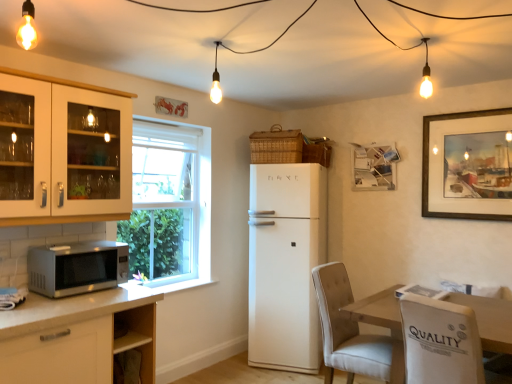
The image size is (512, 384). What do you see at coordinates (285, 264) in the screenshot?
I see `white matte refrigerator at center` at bounding box center [285, 264].

In order to face wooden framed painting at upper right, should I rotate leftwards or rightwards?

Rotate your view right by about 26.276°.

You are a GUI agent. You are given a task and a screenshot of the screen. Output one action in this format:
    pyautogui.click(x=<x>, y=<y>)
    Task: Click on the woven brown basket at upper center, placed as the second basket when sorted from left to right
    The width and height of the screenshot is (512, 384).
    Given the screenshot: What is the action you would take?
    pyautogui.click(x=317, y=153)

You are a GUI agent. You are given a task and a screenshot of the screen. Output one action in this format:
    pyautogui.click(x=<x>, y=<y>)
    Task: Click on the white matte refrigerator at center
    This screenshot has width=512, height=384.
    Given the screenshot: What is the action you would take?
    [285, 264]

From the image's perspective, does woven brown basket at upper center, the 1th basket viewed from the right, appear higher than white matte refrigerator at center?

Yes, from the image's perspective, woven brown basket at upper center, the 1th basket viewed from the right, is on top of white matte refrigerator at center.

Considering the positions of points (328, 163) and (285, 230), is point (328, 163) farther from camera compared to point (285, 230)?

Yes, point (328, 163) is farther from viewer.

In the scene shown: Who is bigger, woven brown basket at upper center, the 1th basket viewed from the right, or white matte refrigerator at center?

Bigger between the two is white matte refrigerator at center.

What's the angular difference between woven brown basket at upper center, the 1th basket viewed from the right, and white matte refrigerator at center's facing directions?

The angle between the facing direction of woven brown basket at upper center, the 1th basket viewed from the right, and the facing direction of white matte refrigerator at center is 19 degrees.

Could you measure the distance between wooden framed painting at upper right and woven brown basket at upper center, placed as the 2th basket when sorted from right to left?

A distance of 1.26 meters exists between wooden framed painting at upper right and woven brown basket at upper center, placed as the 2th basket when sorted from right to left.

From a real-world perspective, is wooden framed painting at upper right below woven brown basket at upper center, which ranks as the 1th basket in left-to-right order?

Yes, from a real-world perspective, wooden framed painting at upper right is beneath woven brown basket at upper center, which ranks as the 1th basket in left-to-right order.

Between wooden framed painting at upper right and woven brown basket at upper center, placed as the 2th basket when sorted from right to left, which one is positioned behind?

woven brown basket at upper center, placed as the 2th basket when sorted from right to left, is more distant.

Is wooden framed painting at upper right looking in the opposite direction of woven brown basket at upper center, placed as the 2th basket when sorted from right to left?

No.

Consider the image. From a real-world perspective, between woven brown basket at upper center, placed as the second basket when sorted from left to right, and satin silver microwave at lower left, who is vertically higher?

woven brown basket at upper center, placed as the second basket when sorted from left to right, is physically above.

Does woven brown basket at upper center, placed as the second basket when sorted from left to right, have a larger size compared to satin silver microwave at lower left?

No, woven brown basket at upper center, placed as the second basket when sorted from left to right, is not bigger than satin silver microwave at lower left.

Is point (326, 151) farther from viewer compared to point (114, 271)?

Yes, point (326, 151) is farther from viewer.

Does woven brown basket at upper center, the 1th basket viewed from the right, turn towards satin silver microwave at lower left?

Yes, woven brown basket at upper center, the 1th basket viewed from the right, is turned towards satin silver microwave at lower left.

From the image's perspective, who appears lower, white fabric chair at lower right or wooden framed painting at upper right?

white fabric chair at lower right, from the image's perspective.

From a real-world perspective, who is located lower, white fabric chair at lower right or wooden framed painting at upper right?

white fabric chair at lower right.

Which is more to the left, white fabric chair at lower right or wooden framed painting at upper right?

From the viewer's perspective, white fabric chair at lower right appears more on the left side.

Measure the distance from white fabric chair at lower right to white matte refrigerator at center.

white fabric chair at lower right is 25.99 inches from white matte refrigerator at center.

Considering the positions of objects white fabric chair at lower right and white matte refrigerator at center in the image provided, who is more to the right, white fabric chair at lower right or white matte refrigerator at center?

white fabric chair at lower right.

Considering the sizes of objects white fabric chair at lower right and white matte refrigerator at center in the image provided, who is wider, white fabric chair at lower right or white matte refrigerator at center?

With larger width is white matte refrigerator at center.

Is white fabric chair at lower right facing towards white matte refrigerator at center?

No, white fabric chair at lower right is not aimed at white matte refrigerator at center.

Where is `table below the woven brown basket at upper center, the 1th basket viewed from the right (from a real-world perspective)`? table below the woven brown basket at upper center, the 1th basket viewed from the right (from a real-world perspective) is located at coordinates (490, 320).

Based on the photo, between wooden table at lower right and woven brown basket at upper center, the 1th basket viewed from the right, which one is positioned in front?

wooden table at lower right is more forward.

Is wooden table at lower right situated inside woven brown basket at upper center, placed as the second basket when sorted from left to right, or outside?

→ wooden table at lower right is spatially situated outside woven brown basket at upper center, placed as the second basket when sorted from left to right.

Is wooden table at lower right aimed at woven brown basket at upper center, placed as the second basket when sorted from left to right?

No, wooden table at lower right is not turned towards woven brown basket at upper center, placed as the second basket when sorted from left to right.

Between point (277, 307) and point (283, 137), which one is positioned behind?

The point (283, 137) is farther.

Is white matte refrigerator at center beside woven brown basket at upper center, placed as the 2th basket when sorted from right to left?

They are not placed beside each other.

From the image's perspective, which one is positioned higher, white matte refrigerator at center or woven brown basket at upper center, which ranks as the 1th basket in left-to-right order?

woven brown basket at upper center, which ranks as the 1th basket in left-to-right order, is shown above in the image.

Considering the relative sizes of white matte refrigerator at center and woven brown basket at upper center, placed as the 2th basket when sorted from right to left, in the image provided, is white matte refrigerator at center shorter than woven brown basket at upper center, placed as the 2th basket when sorted from right to left,?

Incorrect, the height of white matte refrigerator at center does not fall short of that of woven brown basket at upper center, placed as the 2th basket when sorted from right to left.

This screenshot has height=384, width=512. In order to click on refrigerator lying below the woven brown basket at upper center, the 1th basket viewed from the right (from the image's perspective) in this screenshot , I will do `click(285, 264)`.

Where is `picture frame below the woven brown basket at upper center, placed as the 2th basket when sorted from right to left (from a real-world perspective)`? Image resolution: width=512 pixels, height=384 pixels. picture frame below the woven brown basket at upper center, placed as the 2th basket when sorted from right to left (from a real-world perspective) is located at coordinates (468, 165).

Based on their spatial positions, is white matte refrigerator at center or white glass cabinet at left further from satin silver microwave at lower left?

white matte refrigerator at center.

When comparing their distances from wooden table at lower right, does white matte refrigerator at center or woven brown basket at upper center, placed as the second basket when sorted from left to right, seem further?

Among the two, woven brown basket at upper center, placed as the second basket when sorted from left to right, is located further to wooden table at lower right.

Considering their positions, is satin silver microwave at lower left positioned closer to wooden framed painting at upper right than woven brown basket at upper center, which ranks as the 1th basket in left-to-right order?

woven brown basket at upper center, which ranks as the 1th basket in left-to-right order, lies closer to wooden framed painting at upper right than the other object.

Considering their positions, is satin silver microwave at lower left positioned further to woven brown basket at upper center, which ranks as the 1th basket in left-to-right order, than white glass cabinet at left?

Based on the image, satin silver microwave at lower left appears to be further to woven brown basket at upper center, which ranks as the 1th basket in left-to-right order.

Based on their spatial positions, is white fabric chair at lower right or satin silver microwave at lower left further from wooden table at lower right?

satin silver microwave at lower left is further to wooden table at lower right.

When comparing their distances from white fabric chair at lower right, does woven brown basket at upper center, which ranks as the 1th basket in left-to-right order, or white glass cabinet at left seem further?

Among the two, white glass cabinet at left is located further to white fabric chair at lower right.

Considering their positions, is white fabric chair at lower right positioned further to wooden framed painting at upper right than white matte refrigerator at center?

The object further to wooden framed painting at upper right is white fabric chair at lower right.

Looking at the image, which one is located further to wooden framed painting at upper right, satin silver microwave at lower left or white glass cabinet at left?

The object further to wooden framed painting at upper right is satin silver microwave at lower left.

Locate an element on the screen. The image size is (512, 384). picture frame that lies between woven brown basket at upper center, which ranks as the 1th basket in left-to-right order, and white fabric chair at lower right from top to bottom is located at coordinates (468, 165).

You are a GUI agent. You are given a task and a screenshot of the screen. Output one action in this format:
    pyautogui.click(x=<x>, y=<y>)
    Task: Click on the table between white glass cabinet at left and wooden framed painting at upper right in the horizontal direction
    The height and width of the screenshot is (384, 512).
    Given the screenshot: What is the action you would take?
    click(x=490, y=320)

This screenshot has height=384, width=512. Find the location of `refrigerator between satin silver microwave at lower left and woven brown basket at upper center, the 1th basket viewed from the right`. refrigerator between satin silver microwave at lower left and woven brown basket at upper center, the 1th basket viewed from the right is located at coordinates (285, 264).

You are a GUI agent. You are given a task and a screenshot of the screen. Output one action in this format:
    pyautogui.click(x=<x>, y=<y>)
    Task: Click on the refrigerator that lies between woven brown basket at upper center, placed as the 2th basket when sorted from right to left, and white fabric chair at lower right from top to bottom
    The image size is (512, 384).
    Given the screenshot: What is the action you would take?
    pyautogui.click(x=285, y=264)